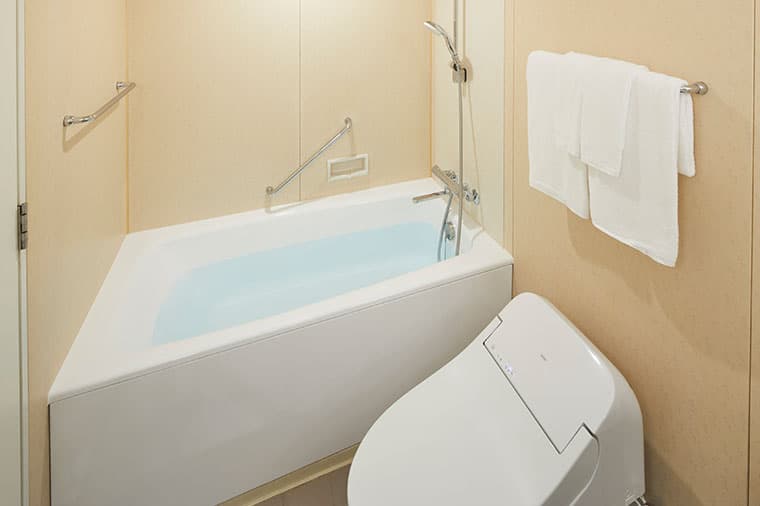
At what (x,y) coordinates should I click in order to perform the action: click on toilet. Please return your answer as a coordinate pair (x, y). Looking at the image, I should click on (451, 427).